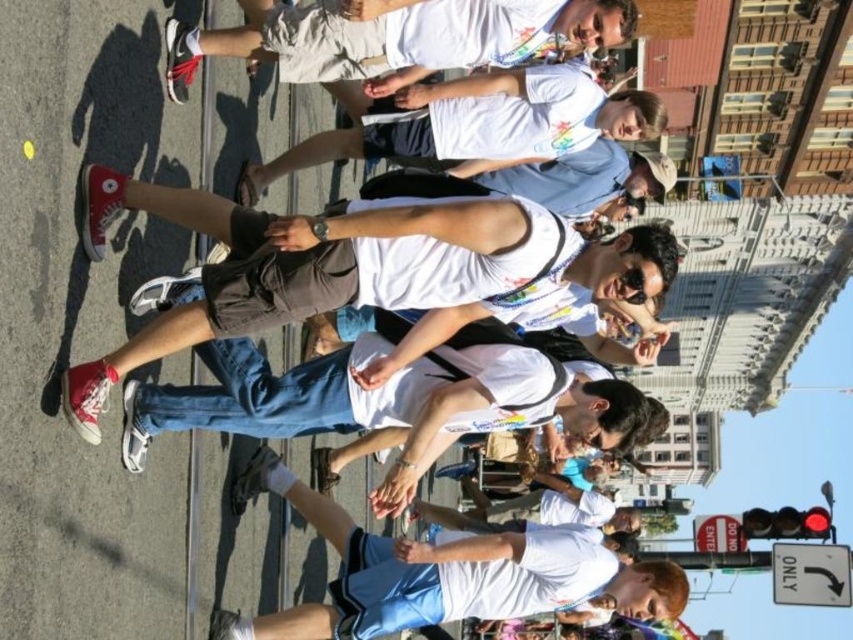
Question: Which of the following is the closest to the observer?

Choices:
 (A) (514, 12)
 (B) (503, 257)

Answer: (B)

Question: Does matte red sneakers at left appear over white cotton t-shirt at center?

Choices:
 (A) no
 (B) yes

Answer: (A)

Question: Is white t-shirt at center to the left of white cotton t-shirt at center from the viewer's perspective?

Choices:
 (A) no
 (B) yes

Answer: (B)

Question: Among these objects, which one is farthest from the camera?

Choices:
 (A) white cotton shirt at center
 (B) matte red sneakers at left
 (C) white t-shirt at center

Answer: (A)

Question: Based on their relative distances, which object is nearer to the white cotton t-shirt at center?

Choices:
 (A) white matte t-shirt at center
 (B) white t-shirt at center

Answer: (B)

Question: Considering the relative positions of white cotton shirt at center and white cotton t-shirt at center in the image provided, where is white cotton shirt at center located with respect to white cotton t-shirt at center?

Choices:
 (A) above
 (B) below

Answer: (B)